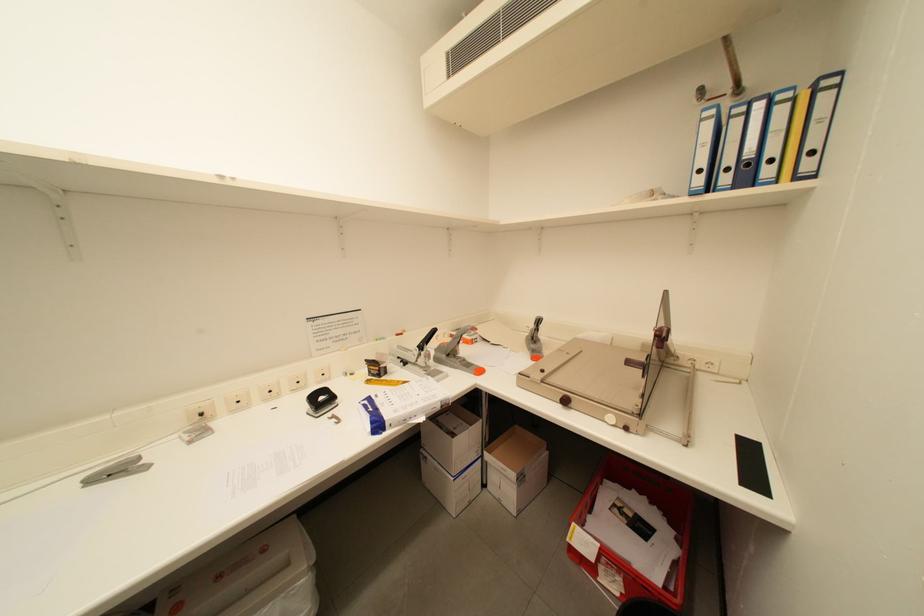
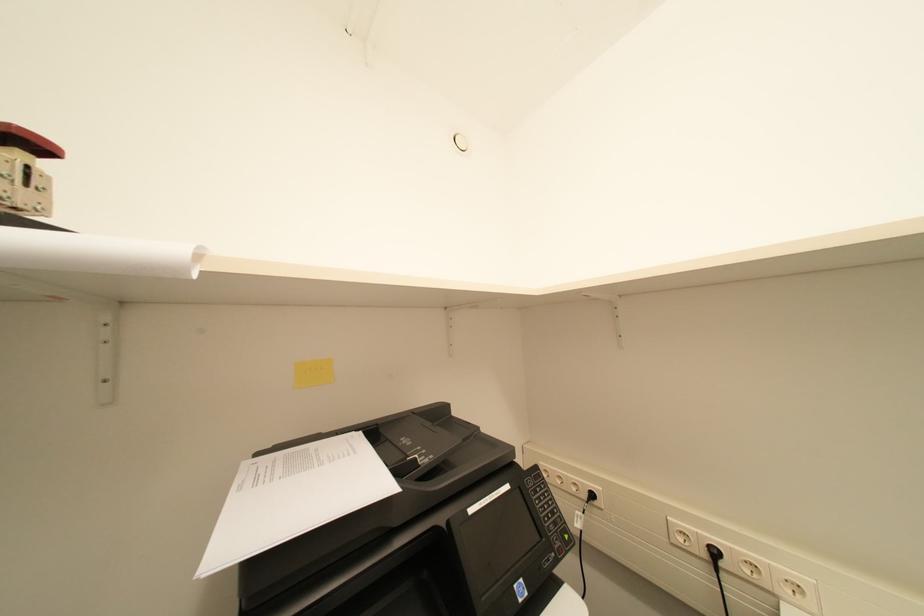
Question: The first image is from the beginning of the video and the second image is from the end. How did the camera likely rotate when shooting the video?

Choices:
 (A) Left
 (B) Right
 (C) Up
 (D) Down

Answer: (A)